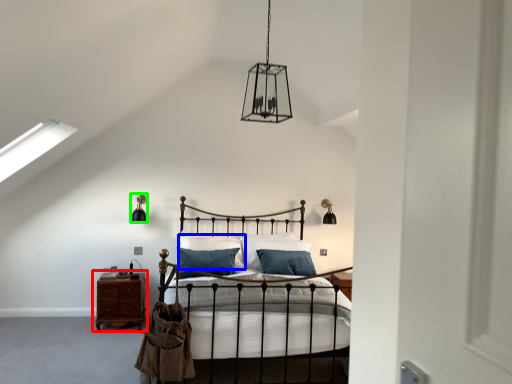
Question: Considering the real-world distances, which object is closest to nightstand (highlighted by a red box)? pillow (highlighted by a blue box) or light fixture (highlighted by a green box).

Choices:
 (A) pillow
 (B) light fixture

Answer: (A)